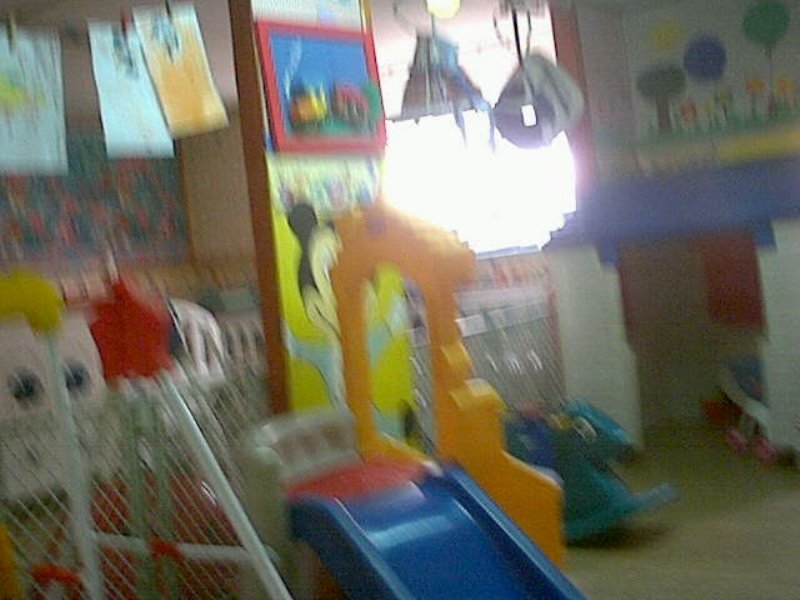
Locate an element on the screen. The height and width of the screenshot is (600, 800). red frame is located at coordinates (330, 144).